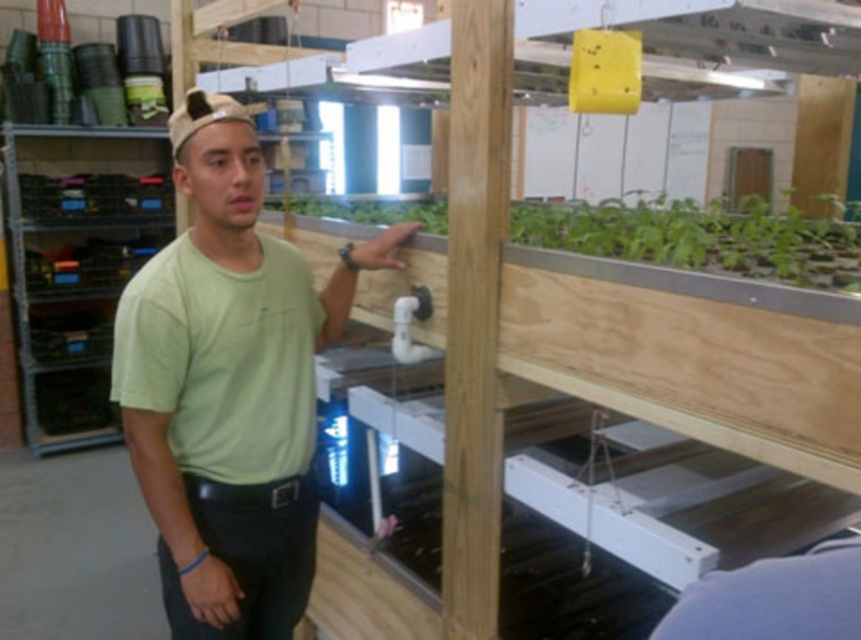
Does light green t-shirt at center have a lesser height compared to green matte plant at center?

Incorrect, light green t-shirt at center's height does not fall short of green matte plant at center's.

The width and height of the screenshot is (861, 640). Describe the element at coordinates (228, 387) in the screenshot. I see `light green t-shirt at center` at that location.

The height and width of the screenshot is (640, 861). What do you see at coordinates (228, 387) in the screenshot?
I see `light green t-shirt at center` at bounding box center [228, 387].

Locate an element on the screen. Image resolution: width=861 pixels, height=640 pixels. light green t-shirt at center is located at coordinates (228, 387).